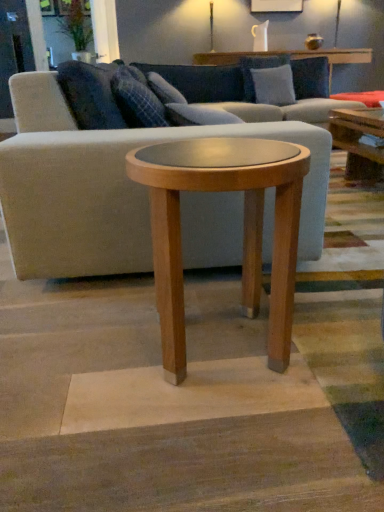
Question: Which is correct: gray fabric pillow at upper center, which appears as the 2th pillow when viewed from the back, is inside light gray fabric couch at center, or outside of it?

Choices:
 (A) inside
 (B) outside

Answer: (A)

Question: Considering the positions of gray fabric pillow at upper center, marked as the 2th pillow in a left-to-right arrangement, and light gray fabric couch at center in the image, is gray fabric pillow at upper center, marked as the 2th pillow in a left-to-right arrangement, bigger or smaller than light gray fabric couch at center?

Choices:
 (A) big
 (B) small

Answer: (B)

Question: Which of these objects is positioned farthest from the light brown wood side table at center?

Choices:
 (A) gray fabric pillow at upper center, which appears as the 2th pillow when viewed from the right
 (B) plaid fabric pillow at center, which is the 1th pillow in front-to-back order
 (C) light gray fabric couch at center
 (D) blue fabric pillow at upper right, the first pillow from the back

Answer: (D)

Question: Which is nearer to the light gray fabric couch at center?

Choices:
 (A) plaid fabric pillow at center, the 1th pillow viewed from the left
 (B) light brown wood side table at center
 (C) blue fabric pillow at upper right, the first pillow from the top
 (D) gray fabric pillow at upper center, placed as the 2th pillow when sorted from bottom to top

Answer: (B)